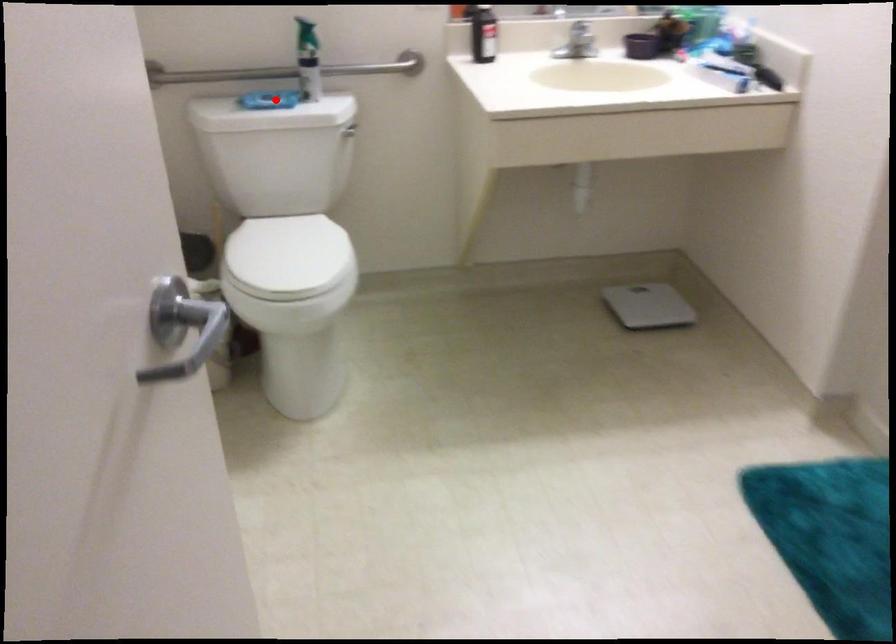
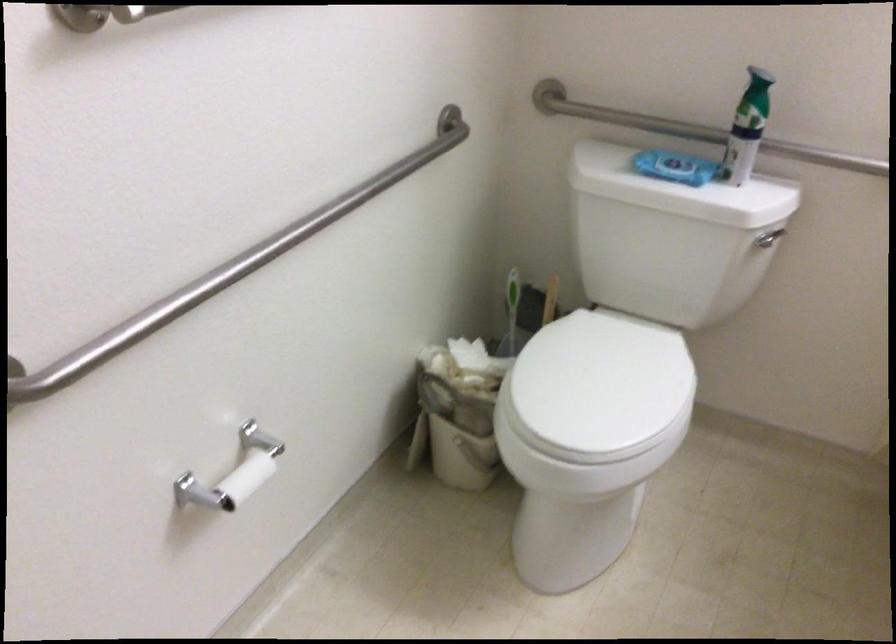
In the second image, find the point that corresponds to the highlighted location in the first image.

(675, 167)